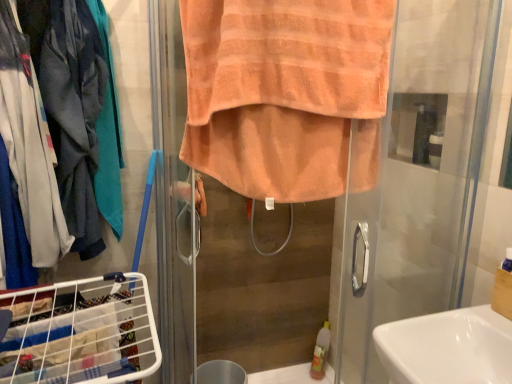
Question: In terms of size, does matte gray jacket at left appear bigger or smaller than white glossy sink at lower right?

Choices:
 (A) big
 (B) small

Answer: (A)

Question: From the image's perspective, relative to white glossy sink at lower right, is matte gray jacket at left above or below?

Choices:
 (A) below
 (B) above

Answer: (B)

Question: Which object is positioned farthest from the orange terry towel at center?

Choices:
 (A) white glossy sink at lower right
 (B) metallic silver trash bin/can at lower center
 (C) matte gray jacket at left
 (D) orange towel at center
 (E) white wire laundry basket at lower left

Answer: (B)

Question: Which of these objects is positioned closest to the white wire laundry basket at lower left?

Choices:
 (A) orange towel at center
 (B) metallic silver trash bin/can at lower center
 (C) matte gray jacket at left
 (D) orange terry towel at center
 (E) white glossy sink at lower right

Answer: (D)